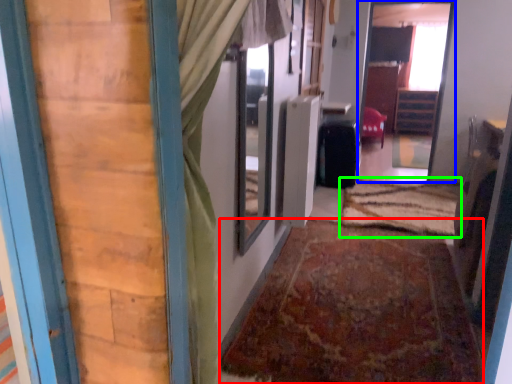
Question: Which object is the closest to the doormat (highlighted by a red box)? Choose among these: passage (highlighted by a blue box) or doormat (highlighted by a green box).

Choices:
 (A) passage
 (B) doormat

Answer: (B)